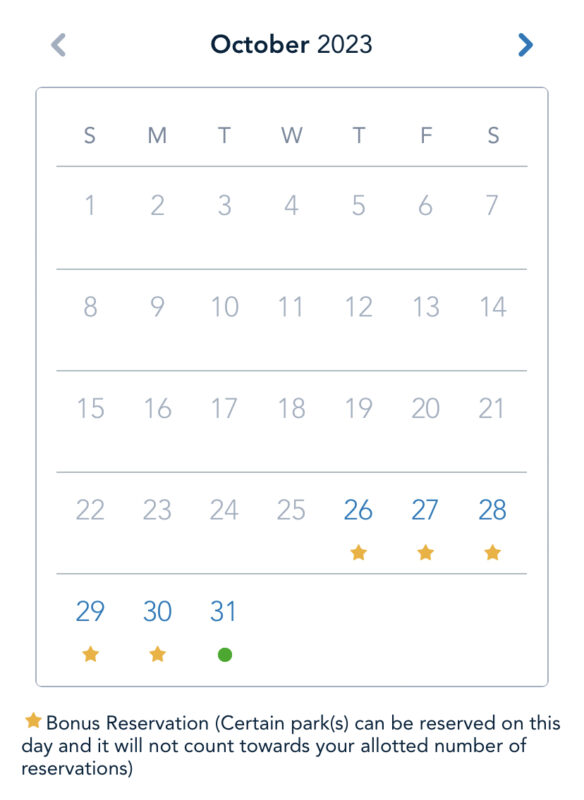
The image size is (584, 800). What are the coordinates of `calendar` in the screenshot? It's located at (61, 122).